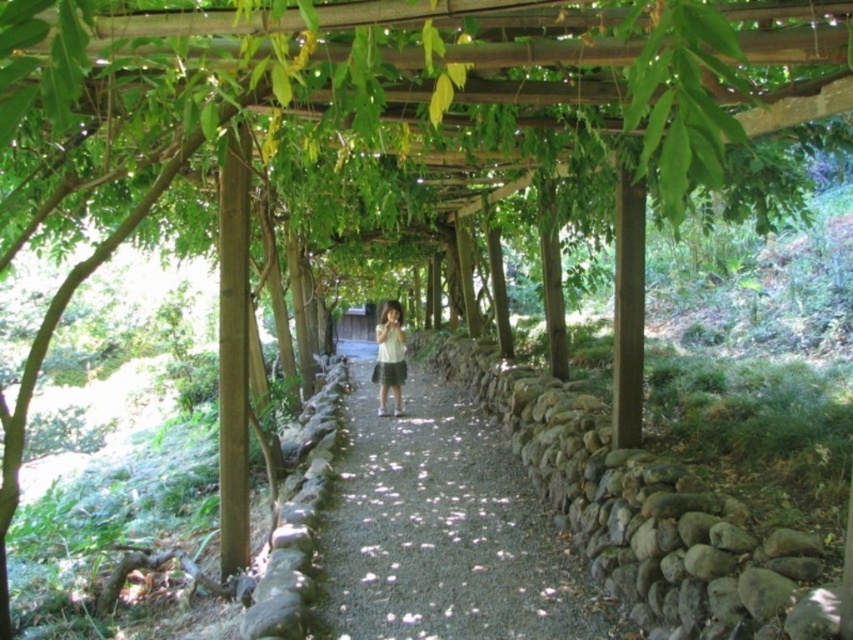
You are a parent watching your child walk on the gravel path at center. You notice the white matte shirt at center. Which object takes up more space in the image?

The white matte shirt at center occupies more space than the gravel path at center according to the description.

You are standing at the center of the gravel pathway under the wooden pergola. There are two points marked on the path ahead of you. Which point is closer to you, point (396,600) or point (395,312)?

Point (396,600) is closer to the viewer than point (395,312).

You are standing at the entrance of the pergola and want to reach the gravel path at center. According to the coordinates provided, in which direction should you walk to reach it?

The gravel path at center is located at coordinates point (444, 531). Since you are at the entrance, which is likely at the lower edge of the image, you should walk upwards and towards the right to reach it.